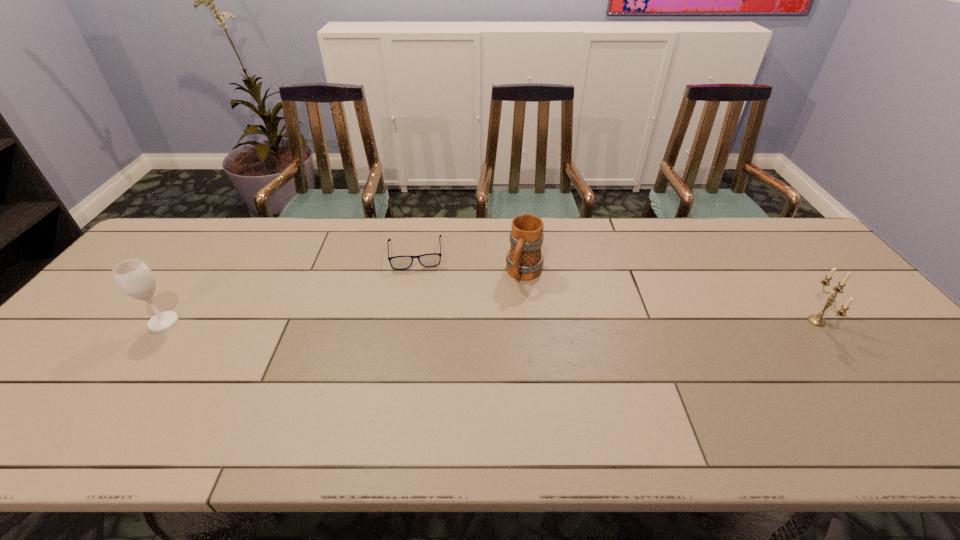
Locate an element on the screen. Image resolution: width=960 pixels, height=540 pixels. vacant area situated 0.170m on the front-facing side of the second object from left to right is located at coordinates (419, 312).

This screenshot has width=960, height=540. What are the coordinates of `free space located 0.150m on the front-facing side of the second object from left to right` in the screenshot? It's located at (419, 306).

At what (x,y) coordinates should I click in order to perform the action: click on vacant space situated on the front-facing side of the second object from left to right. Please return your answer as a coordinate pair (x, y). The height and width of the screenshot is (540, 960). Looking at the image, I should click on (422, 372).

Locate an element on the screen. The height and width of the screenshot is (540, 960). mug that is positioned at the far edge is located at coordinates (524, 261).

Image resolution: width=960 pixels, height=540 pixels. Identify the location of spectacles that is at the far edge. (426, 260).

Locate an element on the screen. This screenshot has width=960, height=540. object that is positioned at the right edge is located at coordinates (817, 320).

Image resolution: width=960 pixels, height=540 pixels. In order to click on vacant space at the far edge in this screenshot , I will do `click(305, 248)`.

What are the coordinates of `vacant area at the near edge of the desktop` in the screenshot? It's located at (436, 409).

The width and height of the screenshot is (960, 540). In the image, there is a desktop. Find the location of `vacant space at the right edge`. vacant space at the right edge is located at coordinates (788, 273).

At what (x,y) coordinates should I click in order to perform the action: click on vacant area at the near left corner. Please return your answer as a coordinate pair (x, y). The width and height of the screenshot is (960, 540). Looking at the image, I should click on (89, 386).